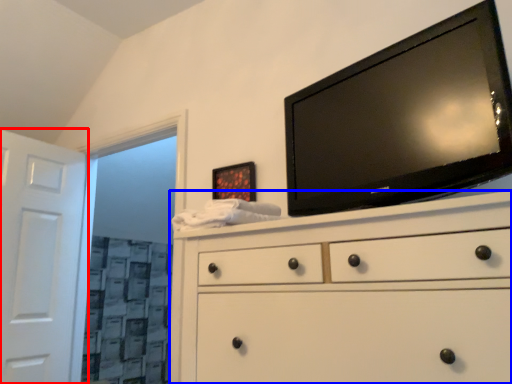
Question: Which point is closer to the camera, door (highlighted by a red box) or chest of drawers (highlighted by a blue box)?

Choices:
 (A) door
 (B) chest of drawers

Answer: (B)